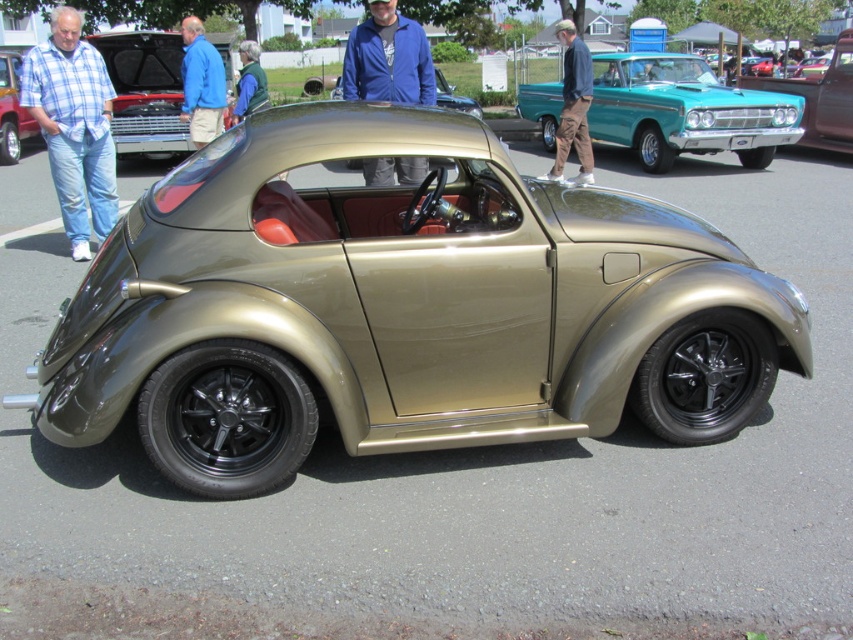
Question: Which of the following is the closest to the observer?

Choices:
 (A) teal glossy pickup truck at upper center
 (B) blue plaid shirt at left
 (C) gold metallic car at center

Answer: (C)

Question: Is gold metallic car at center further to the viewer compared to brown cotton pants at upper center?

Choices:
 (A) no
 (B) yes

Answer: (A)

Question: Which object is the farthest from the gold metallic car at upper left?

Choices:
 (A) teal metallic car at center
 (B) teal glossy pickup truck at upper center

Answer: (A)

Question: Which object is positioned closest to the gold metallic car at center?

Choices:
 (A) blue fabric jacket at upper left
 (B) teal glossy pickup truck at upper center
 (C) teal metallic car at center

Answer: (A)

Question: Is blue fleece jacket at center to the right of blue fabric jacket at upper left from the viewer's perspective?

Choices:
 (A) no
 (B) yes

Answer: (B)

Question: Does blue fleece jacket at center have a lesser width compared to brown cotton pants at upper center?

Choices:
 (A) no
 (B) yes

Answer: (B)